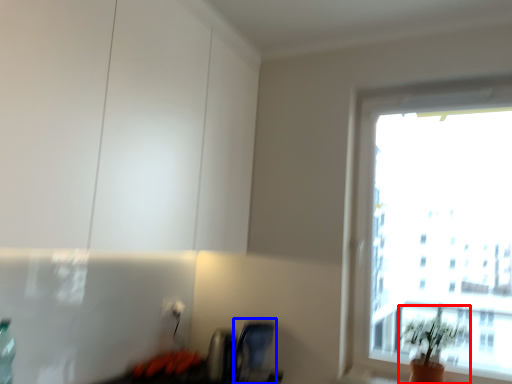
Question: Which object appears closest to the camera in this image, houseplant (highlighted by a red box) or swivel chair (highlighted by a blue box)?

Choices:
 (A) houseplant
 (B) swivel chair

Answer: (A)